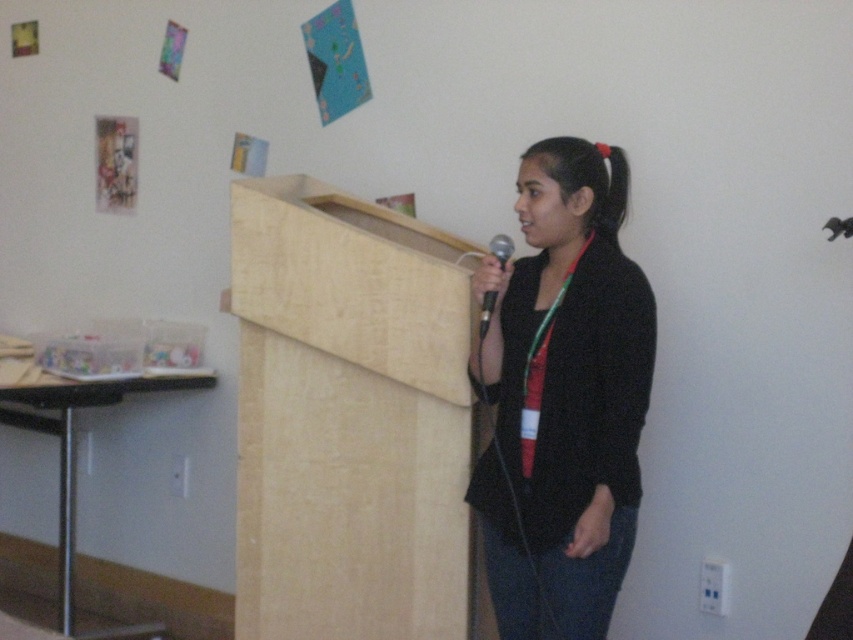
Can you confirm if black matte jacket at center is taller than metallic silver microphone at center?

Correct, black matte jacket at center is much taller as metallic silver microphone at center.

Where is `black matte jacket at center`? black matte jacket at center is located at coordinates (563, 397).

From the picture: Is black matte jacket at center to the left of brown wood podium at lower left from the viewer's perspective?

In fact, black matte jacket at center is to the right of brown wood podium at lower left.

From the picture: Does black matte jacket at center appear under brown wood podium at lower left?

Actually, black matte jacket at center is above brown wood podium at lower left.

Locate an element on the screen. This screenshot has width=853, height=640. black matte jacket at center is located at coordinates (563, 397).

The height and width of the screenshot is (640, 853). I want to click on black matte jacket at center, so click(563, 397).

Does light wood podium at center appear over metallic silver microphone at center?

No, light wood podium at center is not above metallic silver microphone at center.

Which is in front, point (256, 592) or point (506, 250)?

Point (506, 250) is more forward.

This screenshot has width=853, height=640. I want to click on light wood podium at center, so click(x=349, y=420).

Where is `light wood podium at center`? The image size is (853, 640). light wood podium at center is located at coordinates (349, 420).